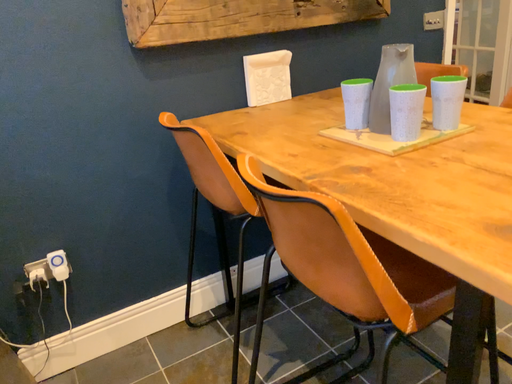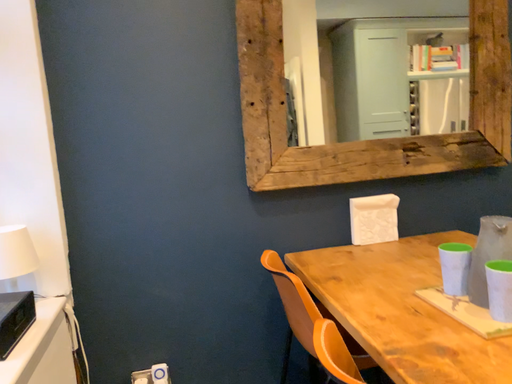
Question: How did the camera likely rotate when shooting the video?

Choices:
 (A) rotated left
 (B) rotated right

Answer: (A)